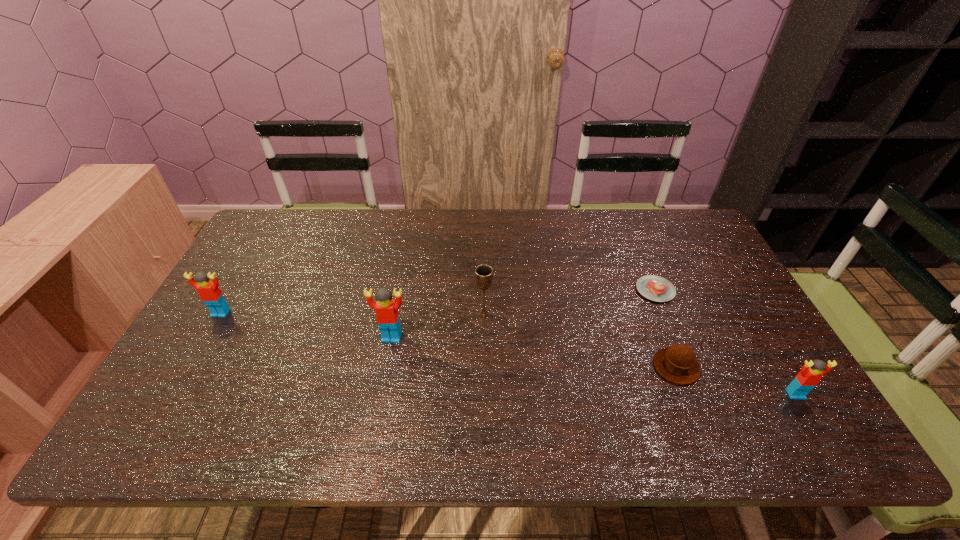
This screenshot has width=960, height=540. I want to click on the leftmost object, so click(x=209, y=292).

You are a GUI agent. You are given a task and a screenshot of the screen. Output one action in this format:
    pyautogui.click(x=<x>, y=<y>)
    Task: Click on the second shortest Lego
    Image resolution: width=960 pixels, height=540 pixels.
    Given the screenshot: What is the action you would take?
    pyautogui.click(x=209, y=292)

Image resolution: width=960 pixels, height=540 pixels. Identify the location of the fourth farthest object. (386, 308).

Locate an element on the screen. the second Lego from right to left is located at coordinates (386, 308).

I want to click on the nearest object, so click(x=811, y=373).

Locate an element on the screen. the rightmost Lego is located at coordinates (811, 373).

This screenshot has width=960, height=540. Identify the location of pastry. (656, 288).

Locate an element on the screen. The image size is (960, 540). the farthest object is located at coordinates (656, 288).

Image resolution: width=960 pixels, height=540 pixels. I want to click on muffin, so click(678, 364).

Locate an element on the screen. the second shortest object is located at coordinates click(x=678, y=364).